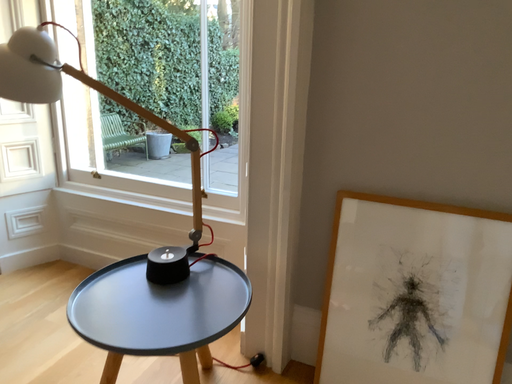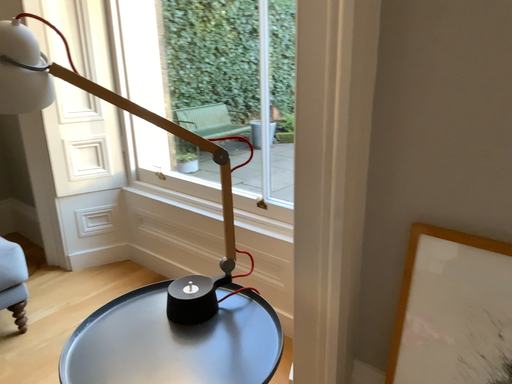
Question: How did the camera likely rotate when shooting the video?

Choices:
 (A) rotated left
 (B) rotated right

Answer: (A)